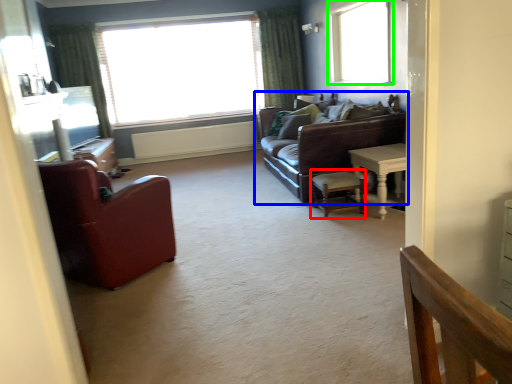
Question: Based on their relative distances, which object is farther from chair (highlighted by a red box)? Choose from studio couch (highlighted by a blue box) and window (highlighted by a green box).

Choices:
 (A) studio couch
 (B) window

Answer: (B)